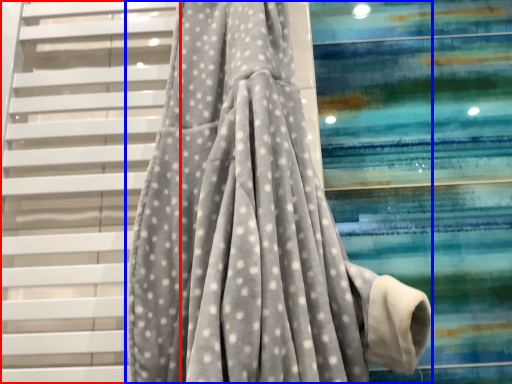
Question: Which object is closer to the camera taking this photo, stairs (highlighted by a red box) or curtain (highlighted by a blue box)?

Choices:
 (A) stairs
 (B) curtain

Answer: (B)